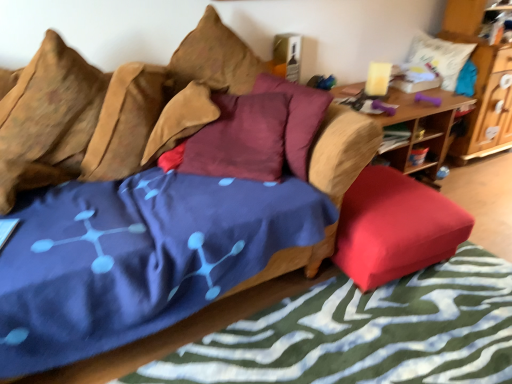
Question: Is the position of velvet-like brown couch at center less distant than that of blue fabric bed frame at lower left?

Choices:
 (A) yes
 (B) no

Answer: (B)

Question: Is velvet-like brown couch at center oriented towards blue fabric bed frame at lower left?

Choices:
 (A) yes
 (B) no

Answer: (A)

Question: From the image's perspective, is velvet-like brown couch at center below blue fabric bed frame at lower left?

Choices:
 (A) yes
 (B) no

Answer: (B)

Question: Is velvet-like brown couch at center at the right side of blue fabric bed frame at lower left?

Choices:
 (A) yes
 (B) no

Answer: (B)

Question: Can we say velvet-like brown couch at center lies outside blue fabric bed frame at lower left?

Choices:
 (A) yes
 (B) no

Answer: (A)

Question: Is wooden cabinet at upper right taller or shorter than velvet-like brown couch at center?

Choices:
 (A) tall
 (B) short

Answer: (A)

Question: From the image's perspective, is wooden cabinet at upper right above or below velvet-like brown couch at center?

Choices:
 (A) above
 (B) below

Answer: (A)

Question: Is wooden cabinet at upper right inside the boundaries of velvet-like brown couch at center, or outside?

Choices:
 (A) outside
 (B) inside

Answer: (A)

Question: From a real-world perspective, relative to velvet-like brown couch at center, is wooden cabinet at upper right vertically above or below?

Choices:
 (A) below
 (B) above

Answer: (B)

Question: Is velvet-like brown couch at center bigger or smaller than red fabric ottoman at lower right?

Choices:
 (A) small
 (B) big

Answer: (B)

Question: Looking at their shapes, would you say velvet-like brown couch at center is wider or thinner than red fabric ottoman at lower right?

Choices:
 (A) wide
 (B) thin

Answer: (A)

Question: From a real-world perspective, is velvet-like brown couch at center physically located above or below red fabric ottoman at lower right?

Choices:
 (A) below
 (B) above

Answer: (B)

Question: In the image, is velvet-like brown couch at center on the left side or the right side of red fabric ottoman at lower right?

Choices:
 (A) right
 (B) left

Answer: (B)

Question: From the image's perspective, is wooden table at right above or below textured brown pillow at upper left, acting as the fourth pillow starting from the right?

Choices:
 (A) above
 (B) below

Answer: (A)

Question: Which is correct: wooden table at right is inside textured brown pillow at upper left, marked as the first pillow in a left-to-right arrangement, or outside of it?

Choices:
 (A) inside
 (B) outside

Answer: (B)